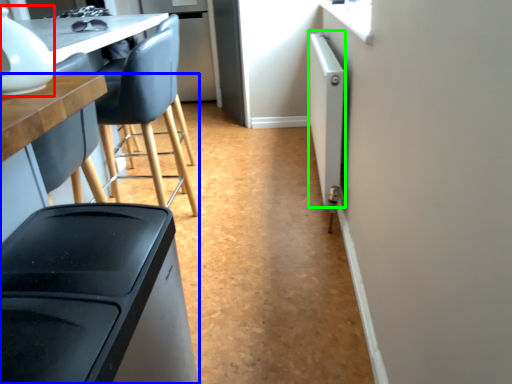
Question: Which object is positioned farthest from appliance (highlighted by a red box)? Select from table (highlighted by a blue box) and appliance (highlighted by a green box).

Choices:
 (A) table
 (B) appliance

Answer: (B)